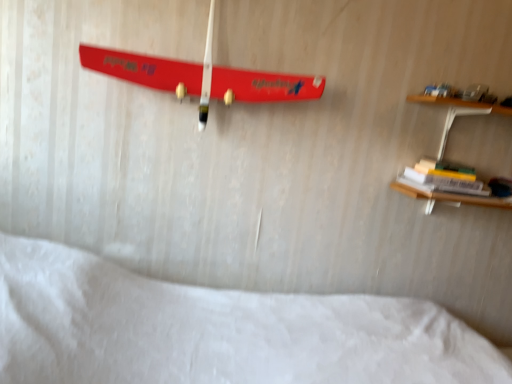
Question: Would you say shiny red skateboard at upper center is a long distance from white soft bed at lower center?

Choices:
 (A) no
 (B) yes

Answer: (A)

Question: Can you confirm if shiny red skateboard at upper center is thinner than white soft bed at lower center?

Choices:
 (A) no
 (B) yes

Answer: (B)

Question: From a real-world perspective, is shiny red skateboard at upper center on white soft bed at lower center?

Choices:
 (A) yes
 (B) no

Answer: (A)

Question: Is white soft bed at lower center surrounded by shiny red skateboard at upper center?

Choices:
 (A) yes
 (B) no

Answer: (B)

Question: Does shiny red skateboard at upper center have a larger size compared to white soft bed at lower center?

Choices:
 (A) yes
 (B) no

Answer: (B)

Question: In terms of size, does shiny red skateboard at upper center appear bigger or smaller than white soft bed at lower center?

Choices:
 (A) big
 (B) small

Answer: (B)

Question: Which is correct: shiny red skateboard at upper center is inside white soft bed at lower center, or outside of it?

Choices:
 (A) inside
 (B) outside

Answer: (B)

Question: Based on their positions, is shiny red skateboard at upper center located to the left or right of white soft bed at lower center?

Choices:
 (A) right
 (B) left

Answer: (B)

Question: From the image's perspective, is shiny red skateboard at upper center above or below white soft bed at lower center?

Choices:
 (A) below
 (B) above

Answer: (B)

Question: Is shiny red skateboard at upper center wider or thinner than hardcover book at right?

Choices:
 (A) thin
 (B) wide

Answer: (A)

Question: From a real-world perspective, is shiny red skateboard at upper center above or below hardcover book at right?

Choices:
 (A) above
 (B) below

Answer: (A)

Question: Based on their sizes in the image, would you say shiny red skateboard at upper center is bigger or smaller than hardcover book at right?

Choices:
 (A) big
 (B) small

Answer: (A)

Question: Is shiny red skateboard at upper center situated inside hardcover book at right or outside?

Choices:
 (A) inside
 (B) outside

Answer: (B)

Question: From a real-world perspective, is hardcover book at right physically located above or below shiny red skateboard at upper center?

Choices:
 (A) below
 (B) above

Answer: (A)

Question: In the image, is hardcover book at right positioned in front of or behind shiny red skateboard at upper center?

Choices:
 (A) front
 (B) behind

Answer: (B)